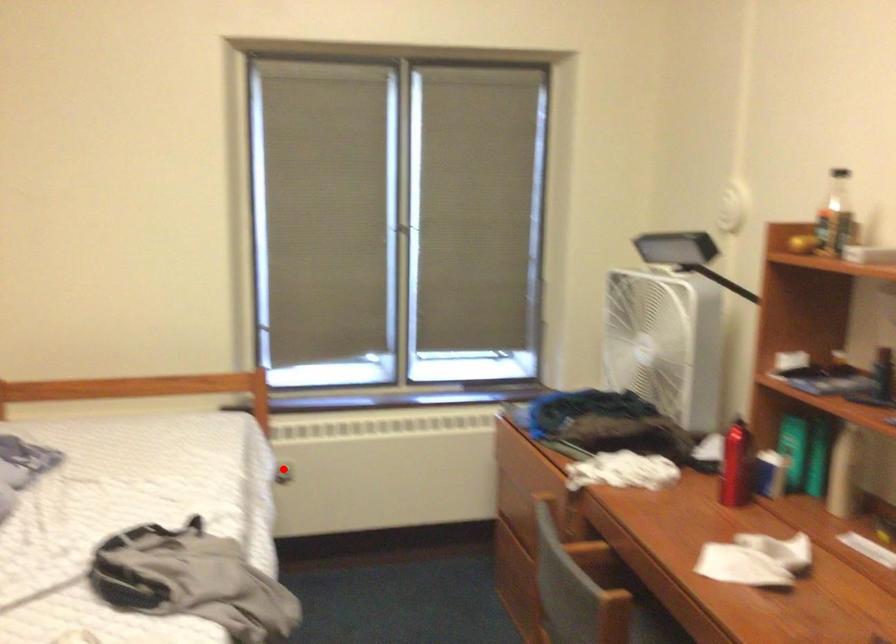
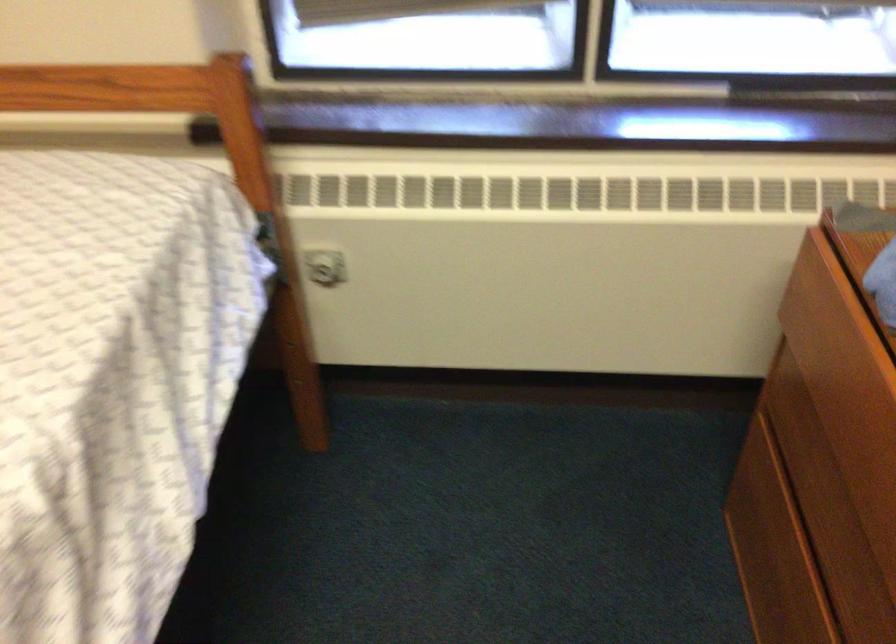
In the second image, find the point that corresponds to the highlighted location in the first image.

(323, 267)